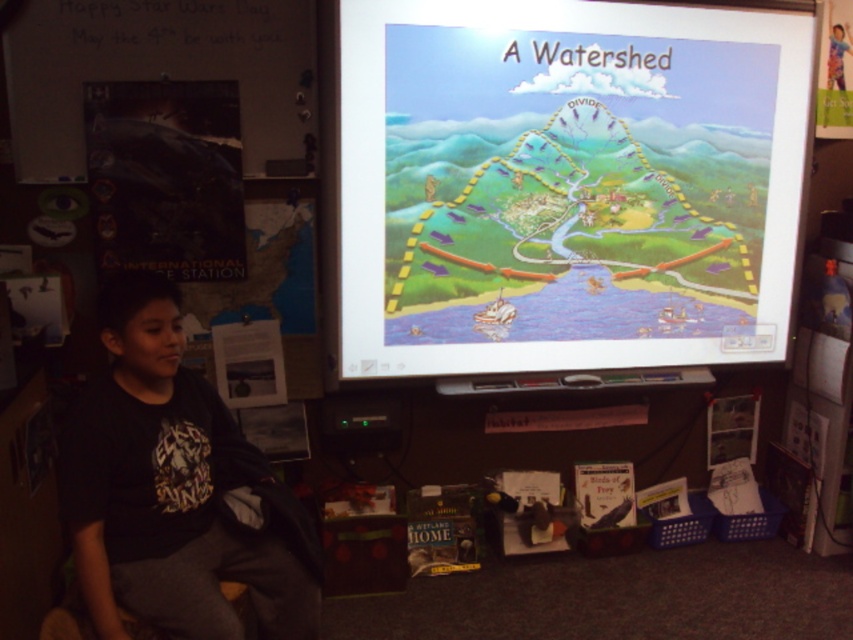
You are a student in the classroom looking at the projector screen. You notice the cartoon map at upper center and the black cotton shirt at lower left. Which object is wider?

The cartoon map at upper center is wider than the black cotton shirt at lower left.

You are a student sitting in the classroom and want to point out the cartoon map at upper center to your friend who is standing next to the black cotton shirt at lower left. Can you reach the pointer on the desk without moving from your seat? The pointer is 2.5 feet away from you.

The distance between the cartoon map at upper center and the black cotton shirt at lower left is 3.53 feet. Since the pointer is only 2.5 feet away from you, you can reach it without moving from your seat.

You are a student sitting in the classroom and want to point out two specific points on the projector screen during the presentation. The points are labeled as point 1 at coordinates point (688, 278) and point 2 at coordinates point (113, 550). Which point is closer to you when you look at them on the screen?

Point (113, 550) is closer to you because it is nearer to the camera compared to point (688, 278), which is further away.